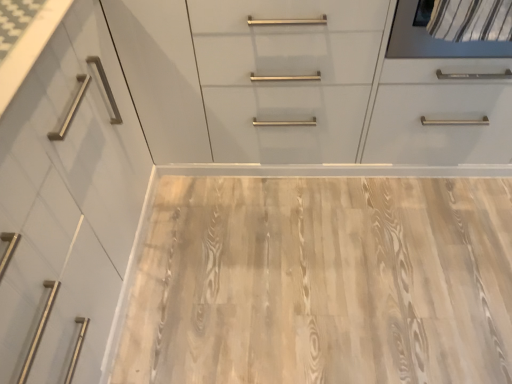
The height and width of the screenshot is (384, 512). Identify the location of free space above light wood/texture plywood at center (from a real-world perspective). (326, 263).